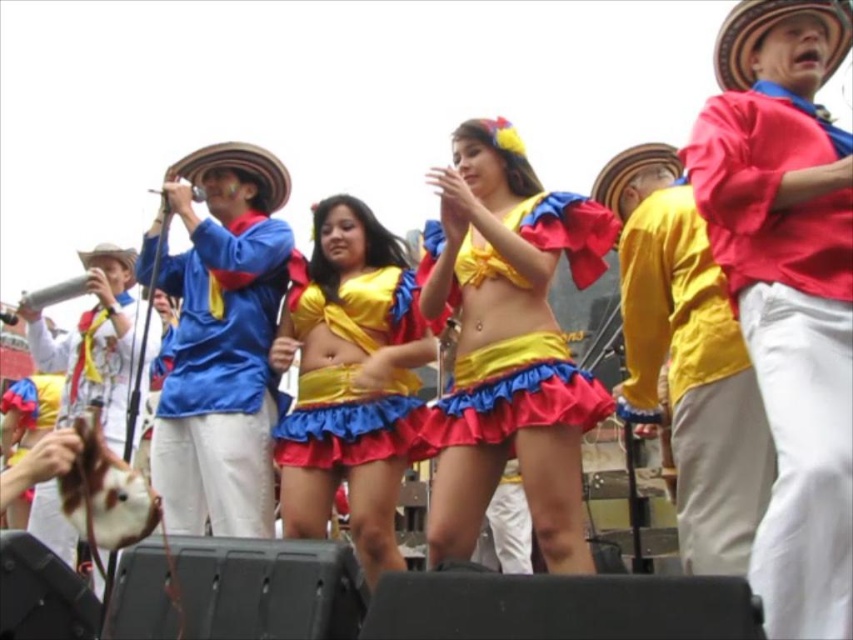
Question: Among these points, which one is nearest to the camera?

Choices:
 (A) (735, 525)
 (B) (392, 397)

Answer: (A)

Question: Considering the real-world distances, which object is farthest from the red cotton shirt at right?

Choices:
 (A) yellow satin bikini top at center
 (B) matte blue shirt at left
 (C) shiny satin skirt at center

Answer: (B)

Question: Which point is closer to the camera taking this photo?

Choices:
 (A) (263, 355)
 (B) (480, 314)

Answer: (B)

Question: Observing the image, what is the correct spatial positioning of yellow satin skirt at center in reference to yellow satin bikini top at center?

Choices:
 (A) left
 (B) right

Answer: (B)

Question: Observing the image, what is the correct spatial positioning of red cotton shirt at right in reference to shiny satin skirt at center?

Choices:
 (A) left
 (B) right

Answer: (B)

Question: Can you confirm if yellow satin skirt at center is positioned to the left of matte blue shirt at left?

Choices:
 (A) yes
 (B) no

Answer: (B)